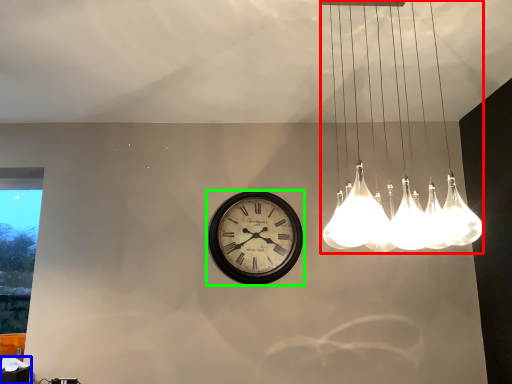
Question: Which object is positioned farthest from lamp (highlighted by a red box)? Select from table (highlighted by a blue box) and wall clock (highlighted by a green box).

Choices:
 (A) table
 (B) wall clock

Answer: (A)